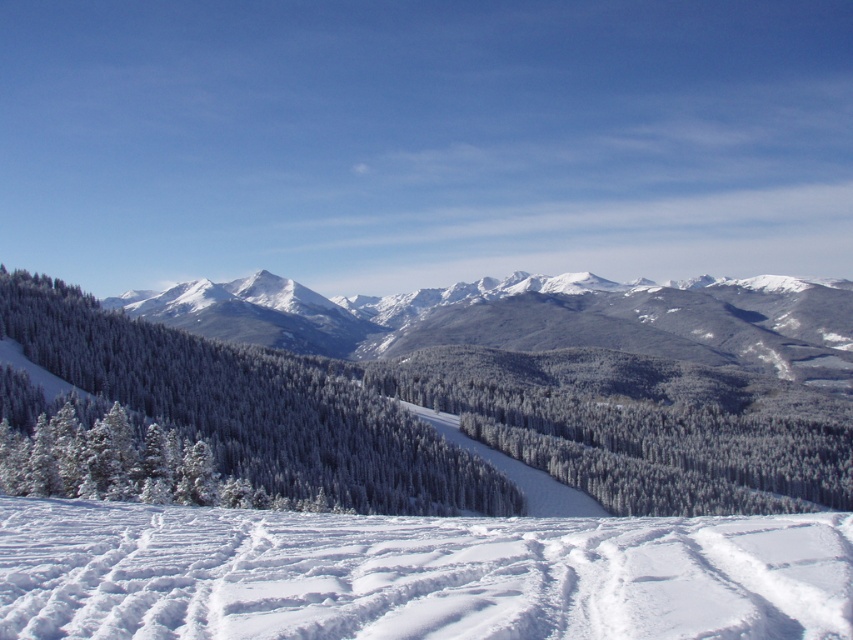
You are planning a ski trip and want to know if the white snow ski slope at lower center leads directly to the snowy rocky mountain at center. Based on the image description, can you determine if the slope is positioned in front of or behind the mountain?

The white snow ski slope at lower center is in front of the snowy rocky mountain at center, so the slope is positioned in front of the mountain.

You are standing at the edge of the snowy terrain in the foreground of the winter landscape. You see a point marked at coordinates (535, 317). What does this point represent in the scene?

The point at coordinates (535, 317) corresponds to a snowy rocky mountain at center.

You are standing at the point marked as point (424, 588) and want to reach the point marked as point (714, 342). Which direction should you move to get closer to your destination?

To move from point (424, 588) to point (714, 342), you should move upward because point (714, 342) is further away from the camera compared to point (424, 588).